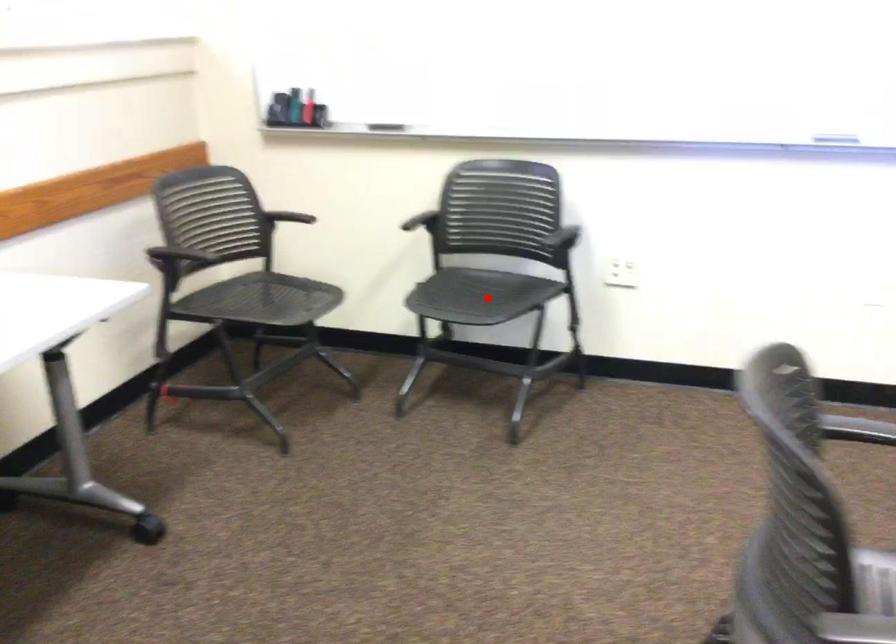
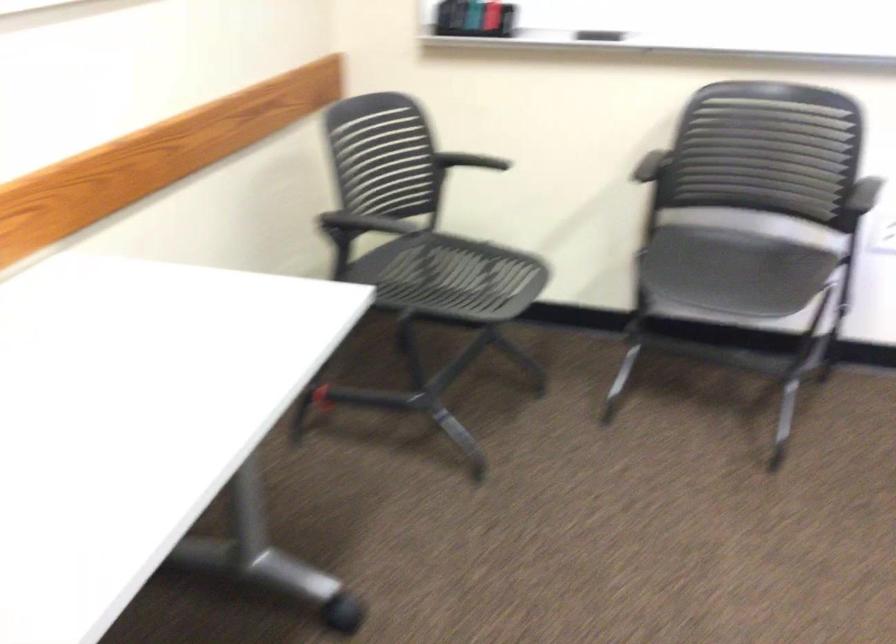
Question: I am providing you with two images of the same scene from different viewpoints. Image1 has a red point marked. In image2, the corresponding 3D location appears at what relative position? Reply with the corresponding letter.

Choices:
 (A) Closer
 (B) Farther

Answer: (A)